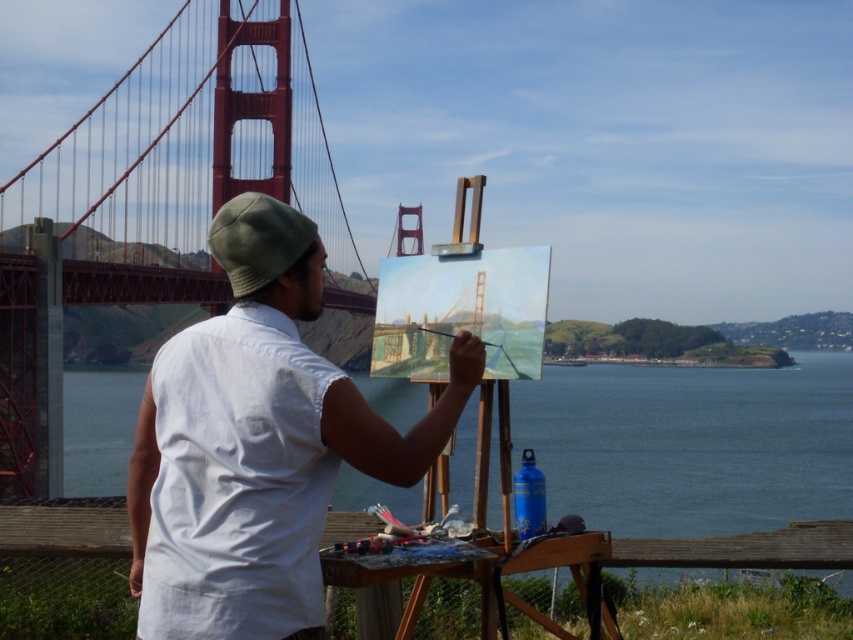
Is white cotton shirt at center to the left of wooden handle paintbrush at center from the viewer's perspective?

Yes, white cotton shirt at center is to the left of wooden handle paintbrush at center.

Between point (292, 428) and point (502, 348), which one is positioned behind?

Positioned behind is point (502, 348).

Is point (171, 468) positioned in front of point (500, 346)?

That is True.

This screenshot has height=640, width=853. I want to click on white cotton shirt at center, so click(x=257, y=444).

Is the position of blue water at center more distant than that of wooden handle paintbrush at center?

No, it is in front of wooden handle paintbrush at center.

Can you confirm if blue water at center is positioned to the left of wooden handle paintbrush at center?

Incorrect, blue water at center is not on the left side of wooden handle paintbrush at center.

Is point (610, 467) more distant than point (432, 332)?

Yes, point (610, 467) is behind point (432, 332).

Identify the location of blue water at center. (691, 444).

Can you confirm if white cotton shirt at center is thinner than blue water at center?

Correct, white cotton shirt at center's width is less than blue water at center's.

Does white cotton shirt at center appear over blue water at center?

Correct, white cotton shirt at center is located above blue water at center.

What do you see at coordinates (257, 444) in the screenshot? The height and width of the screenshot is (640, 853). I see `white cotton shirt at center` at bounding box center [257, 444].

Where is `white cotton shirt at center`? This screenshot has height=640, width=853. white cotton shirt at center is located at coordinates (257, 444).